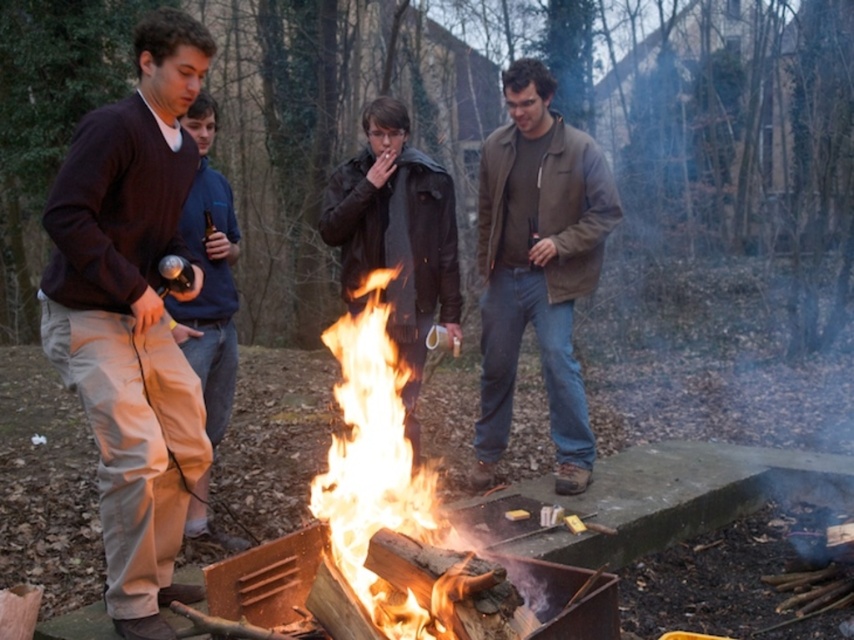
You are standing at the fire pit and want to reach both the point at coordinates point (542,358) and point (215,262). Which point will you reach first?

You will reach point (542,358) first because it is closer to you than point (215,262), which is further away.

You are standing near the fire pit and want to grab your brown leather jacket at center without moving the flamewoodenfire at center. Which direction should you move to reach the jacket?

Result: The brown leather jacket at center is to the right of the flamewoodenfire at center, so you should move to the right to reach the jacket without disturbing the fire.